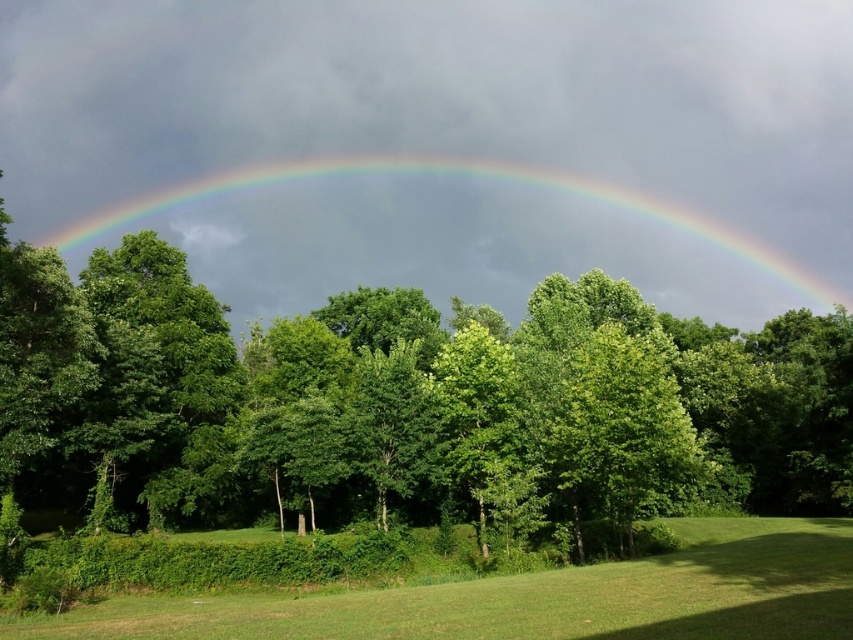
Who is taller, rainbow at upper center or green grass at lower center?

With more height is rainbow at upper center.

Is point (218, 211) positioned in front of point (393, 628)?

No, it is behind (393, 628).

Identify the location of rainbow at upper center. This screenshot has width=853, height=640. (450, 237).

Can you confirm if green leafy tree at center is positioned below rainbow at upper center?

Indeed, green leafy tree at center is positioned under rainbow at upper center.

Is green leafy tree at center smaller than rainbow at upper center?

Yes, green leafy tree at center is smaller than rainbow at upper center.

You are a GUI agent. You are given a task and a screenshot of the screen. Output one action in this format:
    pyautogui.click(x=<x>, y=<y>)
    Task: Click on the green leafy tree at center
    Image resolution: width=853 pixels, height=640 pixels.
    Given the screenshot: What is the action you would take?
    405,404

What are the coordinates of `green leafy tree at center` in the screenshot? It's located at [x=405, y=404].

Find the location of a particular element. This screenshot has height=640, width=853. green leafy tree at center is located at coordinates (405, 404).

The image size is (853, 640). Describe the element at coordinates (405, 404) in the screenshot. I see `green leafy tree at center` at that location.

Which is behind, point (100, 326) or point (151, 596)?

The point (100, 326) is more distant.

At what (x,y) coordinates should I click in order to perform the action: click on green leafy tree at center. Please return your answer as a coordinate pair (x, y). Image resolution: width=853 pixels, height=640 pixels. Looking at the image, I should click on (405, 404).